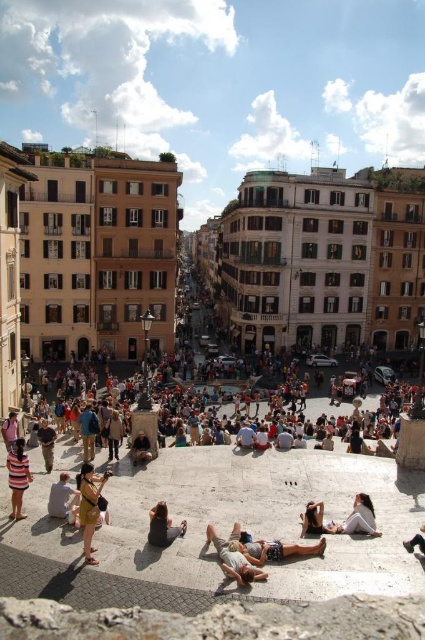
You are a photographer standing at the bottom of the staircase in the public square. You want to take a photo that includes both the matte gold necklace at lower center and the light brown leather person at center. Which object should you focus on first to ensure both are in focus?

You should focus on the matte gold necklace at lower center first because it is closer to you than the light brown leather person at center, so focusing on the closer object will help ensure both are in focus.

You are planning to take a photo of the light brown leather person at center and the brown leather jacket at lower center. Which one should you focus on if you want to capture the wider subject in your shot?

The light brown leather person at center should be focused on because its width is larger than the brown leather jacket at lower center.